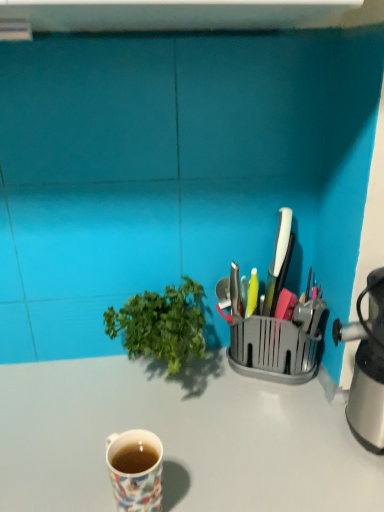
The image size is (384, 512). I want to click on vacant space to the left of green leafy plant at center, so click(62, 399).